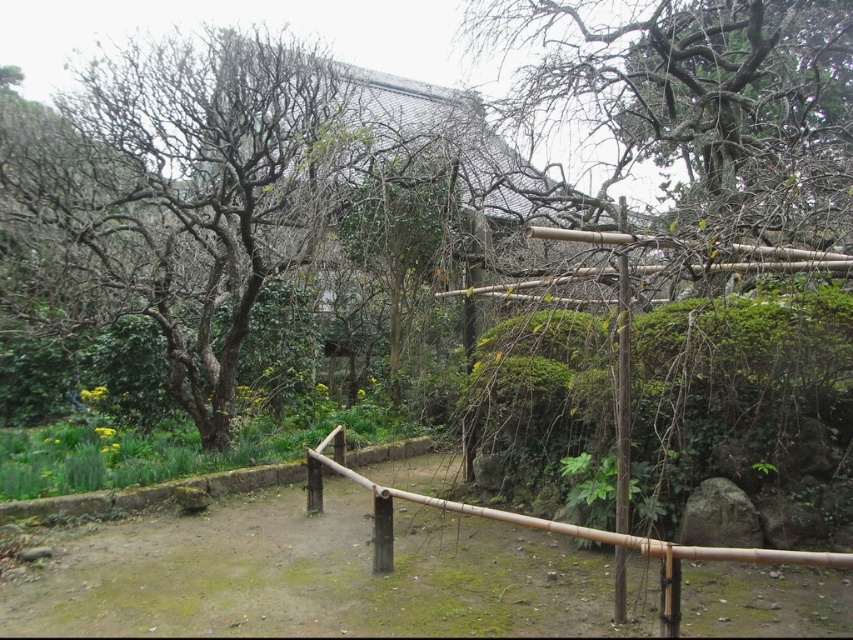
You are standing at the center of the dirt path in the Japanese garden. You want to walk towards the point marked at coordinates (186,189). What will you encounter there?

At point (186,189), you will encounter the bare wood tree at left.

You are walking along the dirt path in the Japanese garden and notice the bare wood tree at left and the bamboo fence at center. Which object is positioned higher in your field of view?

The bare wood tree at left is positioned higher in your field of view because it is located above the bamboo fence at center.